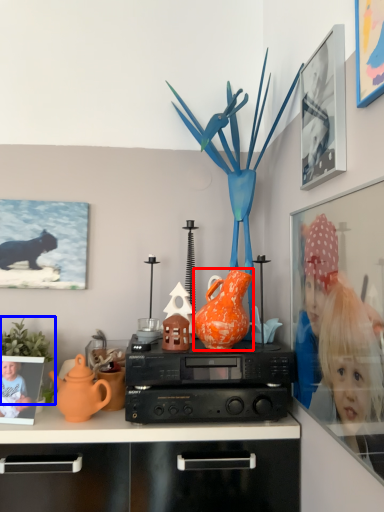
Question: Among these objects, which one is nearest to the camera, vase (highlighted by a red box) or plant (highlighted by a blue box)?

Choices:
 (A) vase
 (B) plant

Answer: (A)